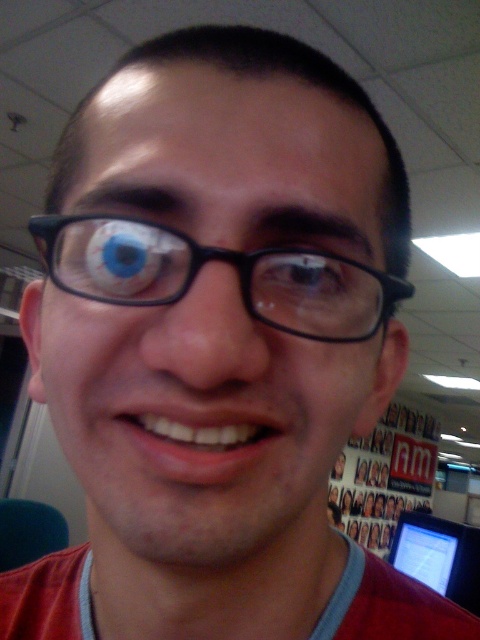
Question: Can you confirm if black plastic glasses at center is thinner than brown matte eye at center?

Choices:
 (A) no
 (B) yes

Answer: (A)

Question: Can you confirm if black plastic glasses at center is wider than matte plastic computer screen at lower right?

Choices:
 (A) no
 (B) yes

Answer: (A)

Question: Estimate the real-world distances between objects in this image. Which object is farther from the matte plastic computer screen at lower right?

Choices:
 (A) brown matte eye at center
 (B) black plastic glasses at center

Answer: (A)

Question: Which point is farther to the camera?

Choices:
 (A) (444, 561)
 (B) (282, 324)

Answer: (A)

Question: Which of the following is the closest to the observer?

Choices:
 (A) brown matte eye at center
 (B) matte plastic computer screen at lower right

Answer: (A)

Question: Does matte plastic computer screen at lower right appear under brown matte eye at center?

Choices:
 (A) yes
 (B) no

Answer: (A)